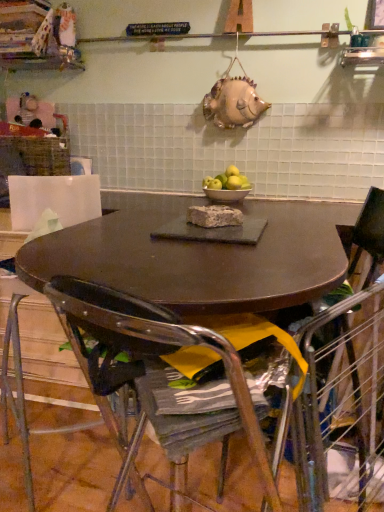
The image size is (384, 512). In order to click on vacant space to the left of brown crumbly cake at center in this screenshot , I will do `click(144, 223)`.